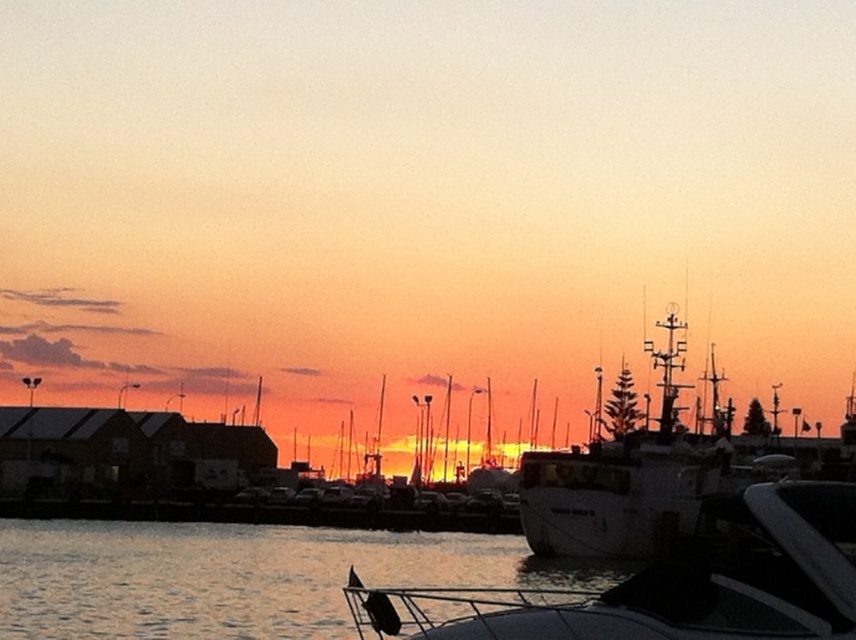
Question: In this image, where is glistening water at lower center located relative to white matte boat at center?

Choices:
 (A) left
 (B) right

Answer: (A)

Question: From the image, what is the correct spatial relationship of glistening water at lower center in relation to white matte boat at center?

Choices:
 (A) above
 (B) below

Answer: (B)

Question: Among these points, which one is farthest from the camera?

Choices:
 (A) (652, 627)
 (B) (473, 545)

Answer: (B)

Question: Does glistening water at lower center have a lesser width compared to white matte boat at center?

Choices:
 (A) yes
 (B) no

Answer: (B)

Question: Which of the following is the closest to the observer?

Choices:
 (A) (828, 502)
 (B) (114, 636)

Answer: (A)